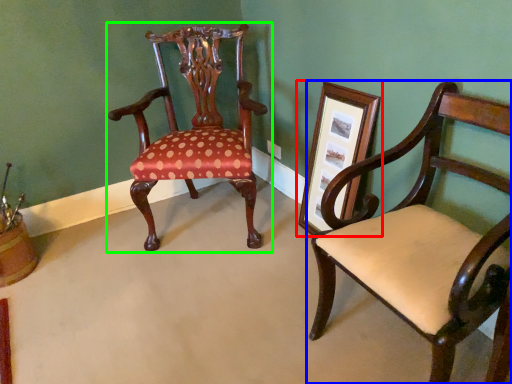
Question: Which object is positioned closest to picture frame (highlighted by a red box)? Select from chair (highlighted by a blue box) and chair (highlighted by a green box).

Choices:
 (A) chair
 (B) chair

Answer: (A)